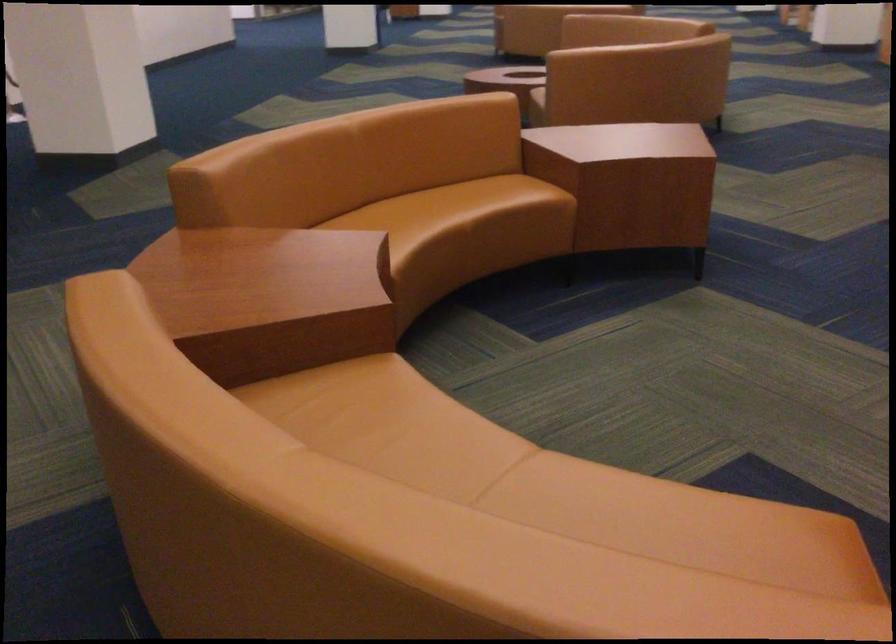
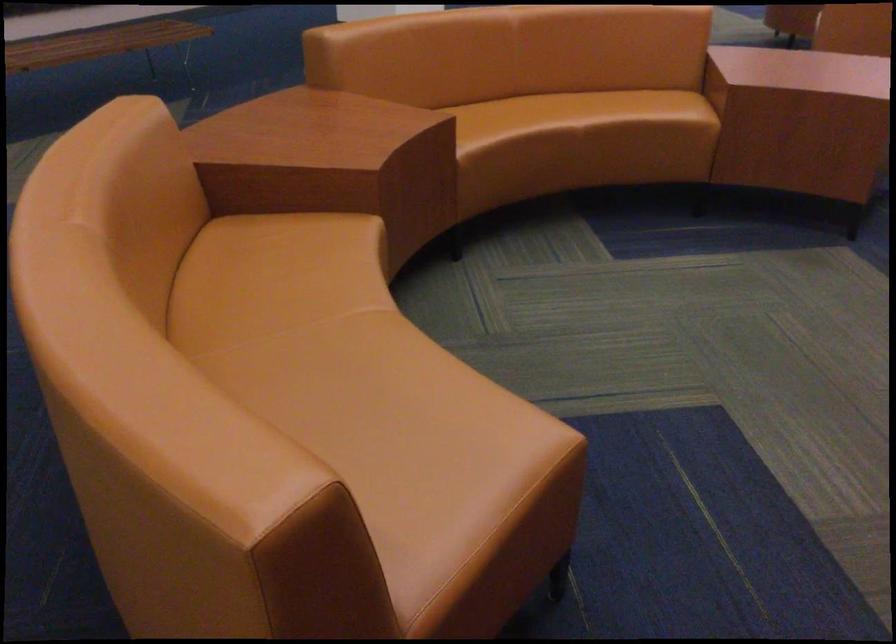
In the second image, find the point that corresponds to [412,216] in the first image.

(538, 113)